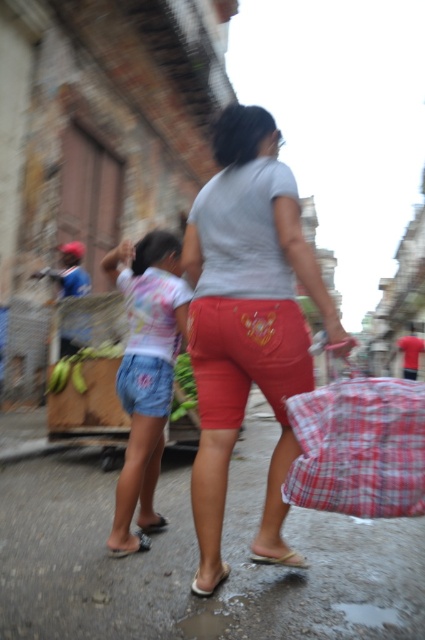
You are standing in the street scene and want to move forward. Which point, point (272, 557) or point (226, 564), will you encounter first?

Point (272, 557) is further to the camera than point (226, 564), so you will encounter point (226, 564) first as it is closer to you.

Consider the image. You are standing at the edge of the street scene and notice two items in the foreground. The first is a matte gray shirt at center and the second is a white rubber sandal at lower center. Which item is positioned to the right side?

The matte gray shirt at center is to the right of the white rubber sandal at lower center.

You are a photographer who wants to focus on the matte gray shirt at center. Given the image is slightly blurred due to motion, can you determine if the point at coordinates (246, 317) is within the area of the matte gray shirt?

The point at coordinates (246, 317) corresponds to the matte gray shirt at center, so yes, it is within the area of the matte gray shirt.